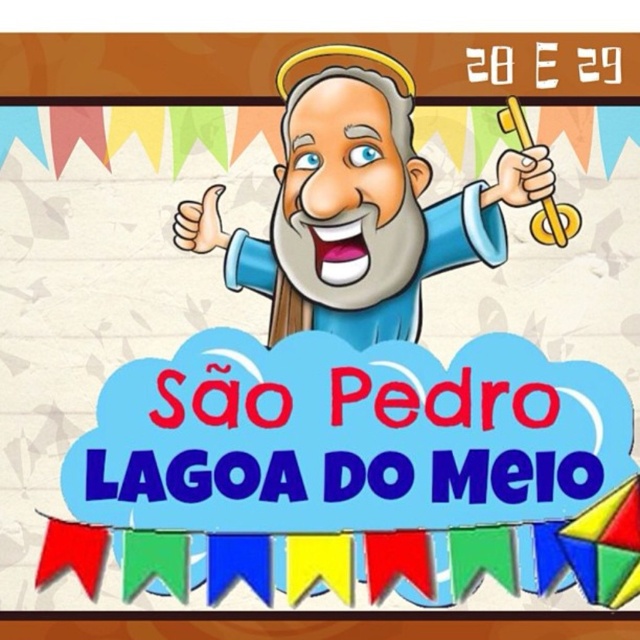
In the scene shown: Based on the scene described, where is the cartoon blue robe at center in relation to the gold metallic key at upper right?

The cartoon blue robe at center is located below the gold metallic key at upper right.